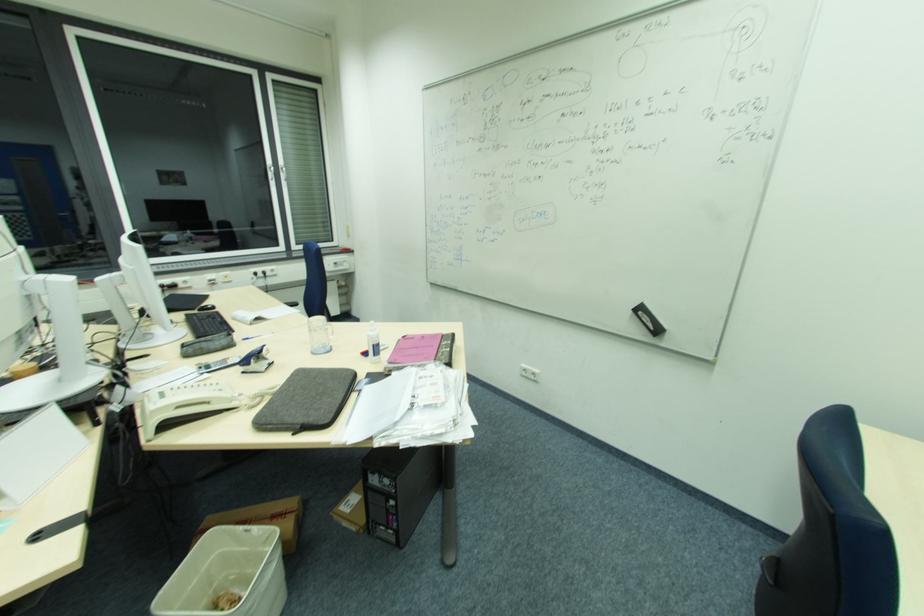
This screenshot has height=616, width=924. Identify the location of white window handle. (272, 174).